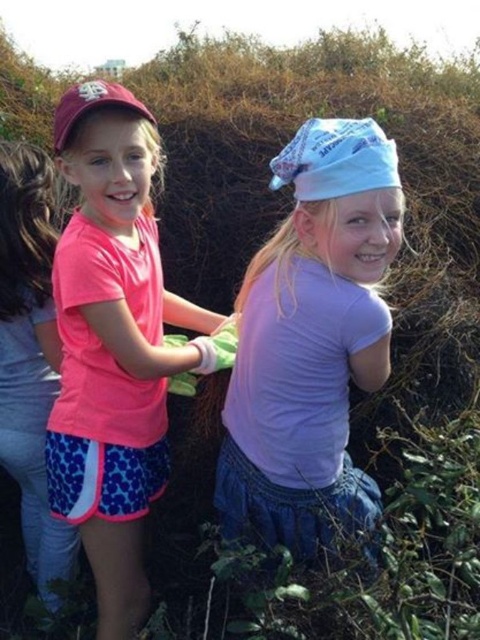
You are a photographer trying to capture a photo of the two girls. You want to ensure that both the light blue fabric bandana at center and the pink matte shirt at left are visible in the frame. Based on their positions, which object is closer to the left edge of the photo?

The pink matte shirt at left is closer to the left edge of the photo because it is positioned to the left of the light blue fabric bandana at center.

Based on the coordinates provided in the image, where is the light blue fabric bandana at center located?

The light blue fabric bandana at center is located at the coordinates point (311, 340).